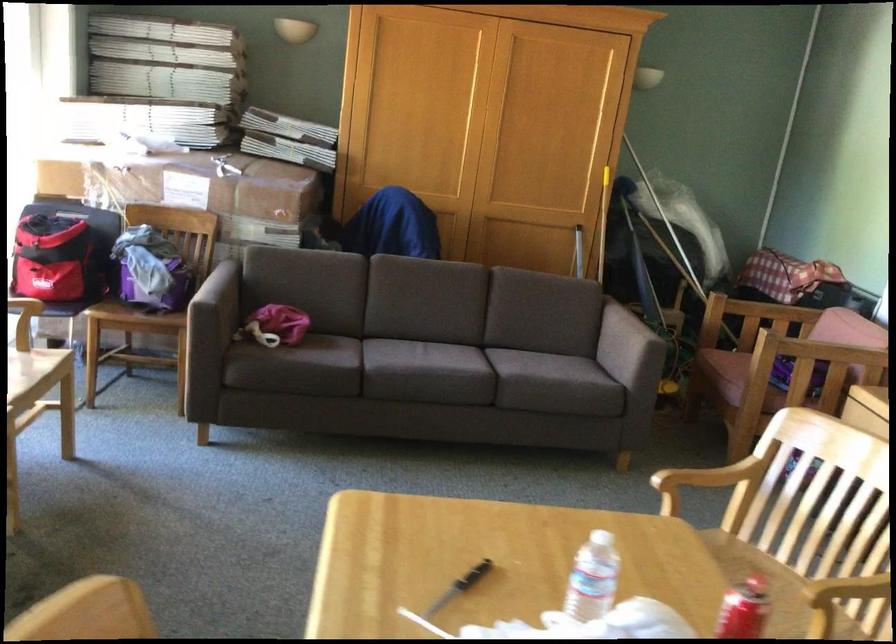
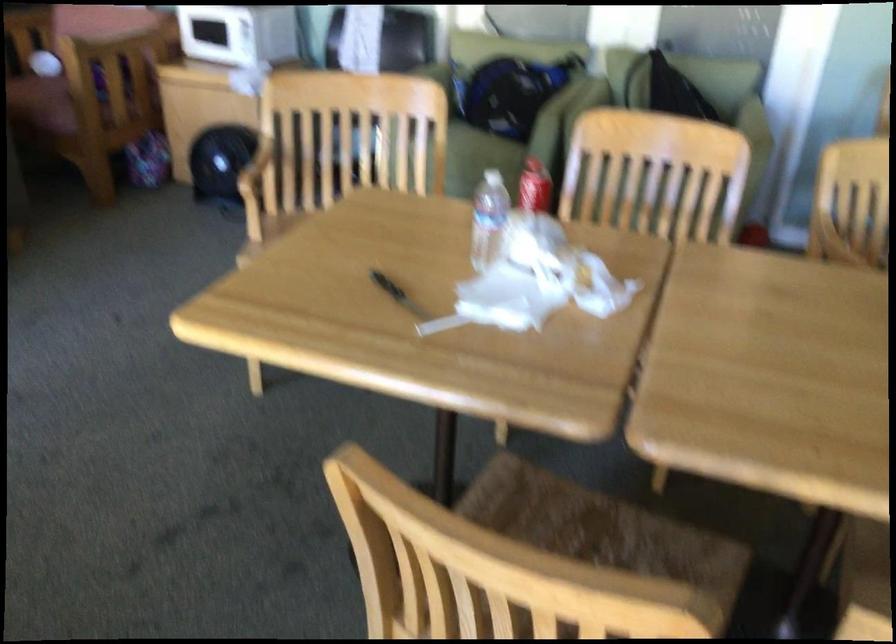
The point at [727,478] is marked in the first image. Where is the corresponding point in the second image?

(255, 166)